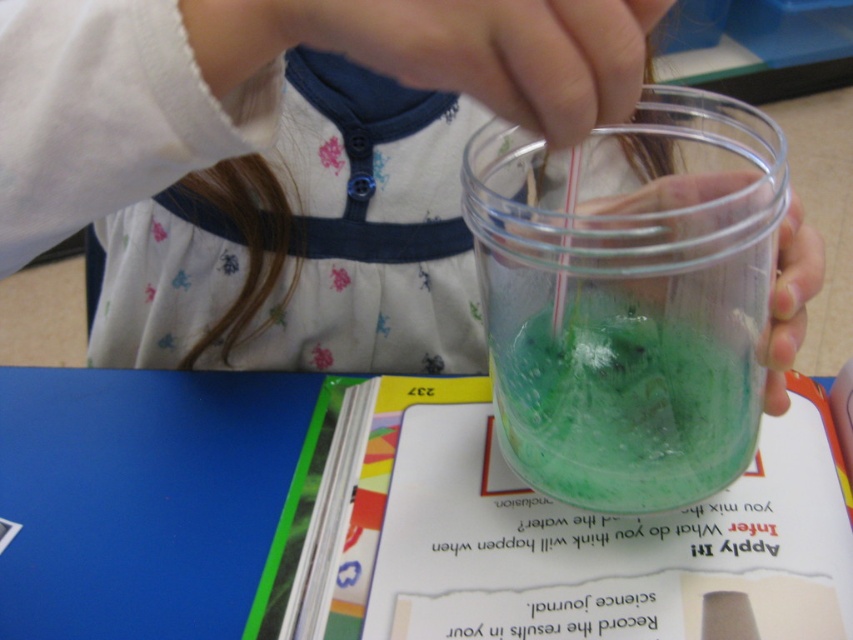
The child is holding a translucent plastic cup at center and there is a translucent green liquid at center. Which object is closer to the viewer?

The translucent plastic cup at center is closer to the viewer than the translucent green liquid at center.

The child is holding a translucent plastic cup at center filled with translucent green liquid at center. The cup is much taller than the liquid inside. If the child wants to pour the liquid into a shorter cup without spilling, what should they do?

The child should carefully pour the translucent green liquid at center into the shorter cup, ensuring not to tilt the translucent plastic cup at center too much to prevent spilling since the cup is much taller than the liquid inside.